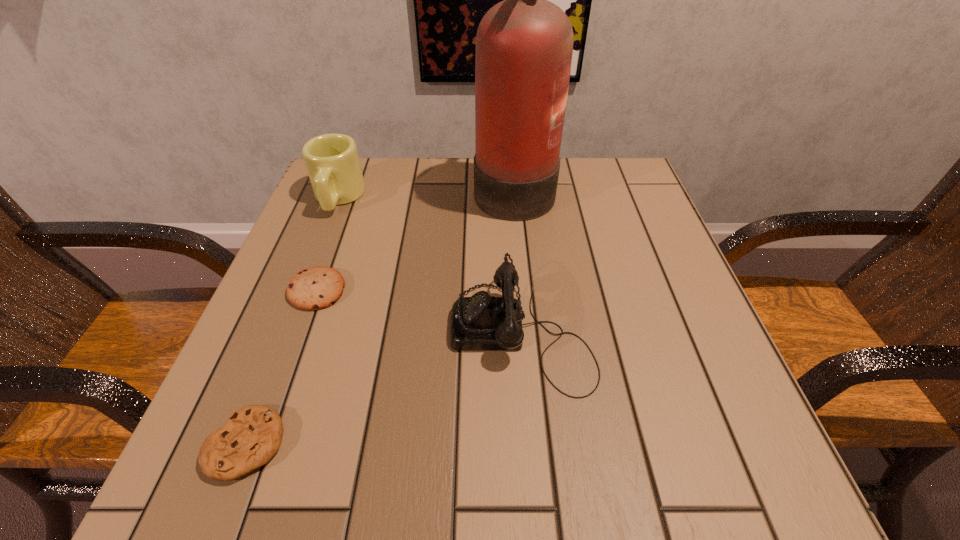
Locate an element on the screen. vacant space positioned 0.100m on the front-facing side of the telephone is located at coordinates (392, 331).

Where is `free space located 0.210m on the front-facing side of the telephone`? This screenshot has height=540, width=960. free space located 0.210m on the front-facing side of the telephone is located at coordinates (327, 331).

Identify the location of vacant space situated 0.180m on the front of the farther cookie. (276, 404).

Locate an element on the screen. This screenshot has height=540, width=960. vacant space located on the right of the nearest object is located at coordinates (530, 444).

You are a GUI agent. You are given a task and a screenshot of the screen. Output one action in this format:
    pyautogui.click(x=<x>, y=<y>)
    Task: Click on the fire extinguisher that is at the far edge
    Image resolution: width=960 pixels, height=540 pixels.
    Given the screenshot: What is the action you would take?
    pyautogui.click(x=524, y=45)

At what (x,y) coordinates should I click in order to perform the action: click on mug present at the far edge. Please return your answer as a coordinate pair (x, y). The height and width of the screenshot is (540, 960). Looking at the image, I should click on (332, 161).

Locate an element on the screen. This screenshot has width=960, height=540. object located at the near edge is located at coordinates (252, 435).

The width and height of the screenshot is (960, 540). In order to click on mug at the left edge in this screenshot , I will do `click(332, 161)`.

Locate an element on the screen. This screenshot has width=960, height=540. object at the far left corner is located at coordinates (332, 161).

Identify the location of object that is at the near left corner. (252, 435).